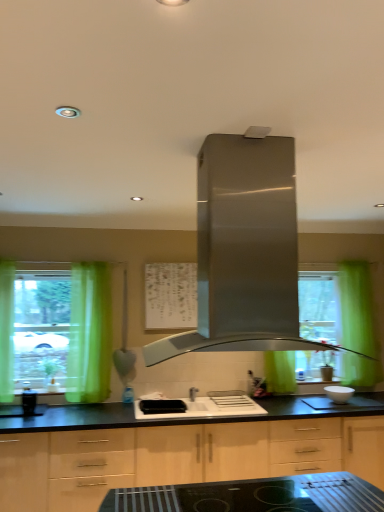
You are a GUI agent. You are given a task and a screenshot of the screen. Output one action in this format:
    pyautogui.click(x=<x>, y=<y>)
    Task: Click on the free space in front of white matte bowl at lower right
    The height and width of the screenshot is (512, 384).
    Given the screenshot: What is the action you would take?
    pyautogui.click(x=353, y=406)